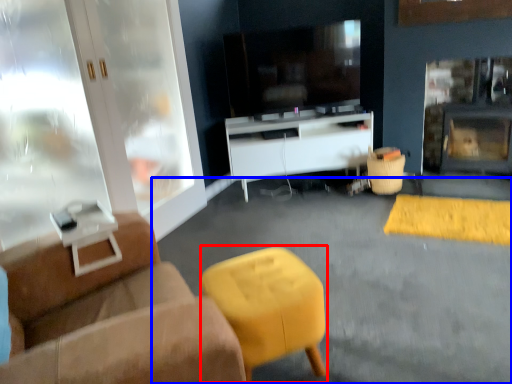
Question: Which object appears closest to the camera in this image, bar stool (highlighted by a red box) or concrete (highlighted by a blue box)?

Choices:
 (A) bar stool
 (B) concrete

Answer: (B)